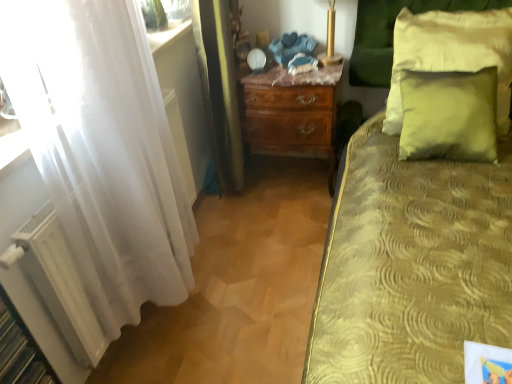
Question: From the image's perspective, is white sheer curtain at left on green velvet pillow at upper right, which is counted as the second pillow, starting from the bottom?

Choices:
 (A) no
 (B) yes

Answer: (A)

Question: Considering the relative sizes of white sheer curtain at left and green velvet pillow at upper right, which is counted as the second pillow, starting from the bottom, in the image provided, is white sheer curtain at left wider than green velvet pillow at upper right, which is counted as the second pillow, starting from the bottom,?

Choices:
 (A) yes
 (B) no

Answer: (A)

Question: Considering the relative sizes of white sheer curtain at left and green velvet pillow at upper right, which is counted as the second pillow, starting from the bottom, in the image provided, is white sheer curtain at left taller than green velvet pillow at upper right, which is counted as the second pillow, starting from the bottom,?

Choices:
 (A) yes
 (B) no

Answer: (A)

Question: Would you say white sheer curtain at left is outside green velvet pillow at upper right, which is counted as the second pillow, starting from the bottom?

Choices:
 (A) no
 (B) yes

Answer: (B)

Question: Considering the relative positions of white sheer curtain at left and green velvet pillow at upper right, the first pillow positioned from the top, in the image provided, is white sheer curtain at left in front of green velvet pillow at upper right, the first pillow positioned from the top,?

Choices:
 (A) no
 (B) yes

Answer: (B)

Question: From a real-world perspective, is white sheer curtain at left on top of green velvet pillow at upper right, the first pillow positioned from the top?

Choices:
 (A) no
 (B) yes

Answer: (B)

Question: Is mahogany wood nightstand at center at the left side of green velvet pillow at upper right, which appears as the first pillow when ordered from the bottom?

Choices:
 (A) yes
 (B) no

Answer: (A)

Question: Does mahogany wood nightstand at center have a lesser height compared to green velvet pillow at upper right, the second pillow positioned from the top?

Choices:
 (A) no
 (B) yes

Answer: (A)

Question: Would you say green velvet pillow at upper right, which appears as the first pillow when ordered from the bottom, is part of mahogany wood nightstand at center's contents?

Choices:
 (A) yes
 (B) no

Answer: (B)

Question: Considering the relative sizes of mahogany wood nightstand at center and green velvet pillow at upper right, the second pillow positioned from the top, in the image provided, is mahogany wood nightstand at center taller than green velvet pillow at upper right, the second pillow positioned from the top,?

Choices:
 (A) yes
 (B) no

Answer: (A)

Question: Is mahogany wood nightstand at center positioned behind green velvet pillow at upper right, the second pillow positioned from the top?

Choices:
 (A) yes
 (B) no

Answer: (A)

Question: Is mahogany wood nightstand at center located outside green velvet pillow at upper right, which appears as the first pillow when ordered from the bottom?

Choices:
 (A) no
 (B) yes

Answer: (B)

Question: Is green velvet pillow at upper right, the first pillow positioned from the top, at the left side of white sheer curtain at left?

Choices:
 (A) no
 (B) yes

Answer: (A)